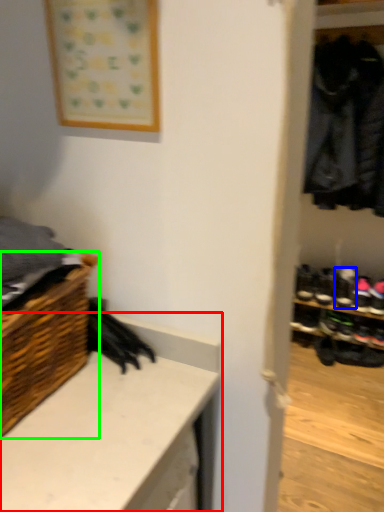
Question: Considering the real-world distances, which object is farthest from counter (highlighted by a red box)? footwear (highlighted by a blue box) or shelf (highlighted by a green box)?

Choices:
 (A) footwear
 (B) shelf

Answer: (A)